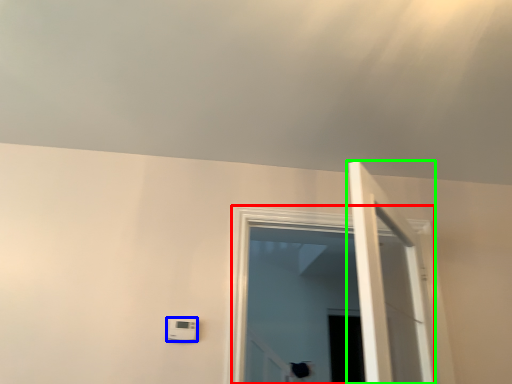
Question: Which is farther away from window (highlighted by a red box)? light switch (highlighted by a blue box) or door (highlighted by a green box)?

Choices:
 (A) light switch
 (B) door

Answer: (B)